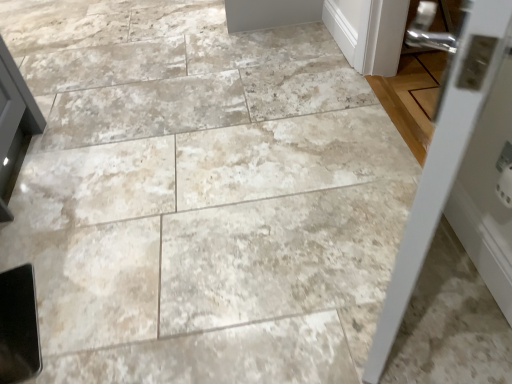
The image size is (512, 384). Identify the location of unoccupied area behind white glossy door at right, acting as the first door starting from the bottom. (333, 176).